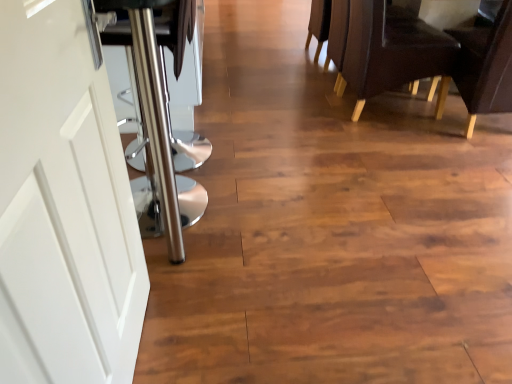
The image size is (512, 384). Identify the location of vacant area that lies between leather-like dark brown chair at right, the 1th chair from the left, and brown leather chair at upper right, the 2th chair when ordered from left to right. (416, 134).